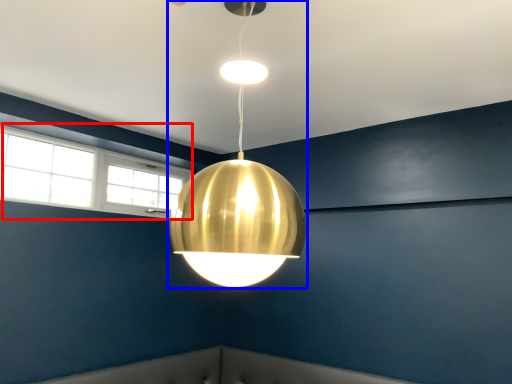
Question: Which object is further to the camera taking this photo, window (highlighted by a red box) or lamp (highlighted by a blue box)?

Choices:
 (A) window
 (B) lamp

Answer: (A)